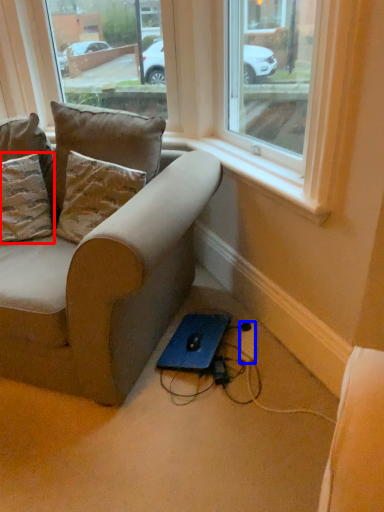
Question: Which object is closer to the camera taking this photo, pillow (highlighted by a red box) or extension cord (highlighted by a blue box)?

Choices:
 (A) pillow
 (B) extension cord

Answer: (A)